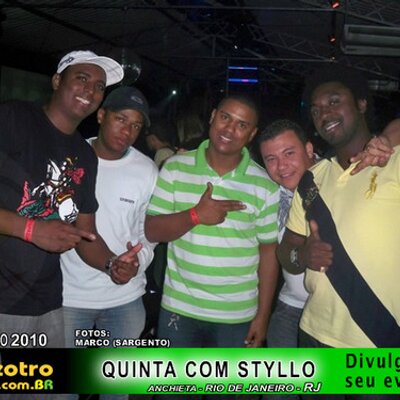
Find the location of a particular element. ceiling is located at coordinates click(x=296, y=26).